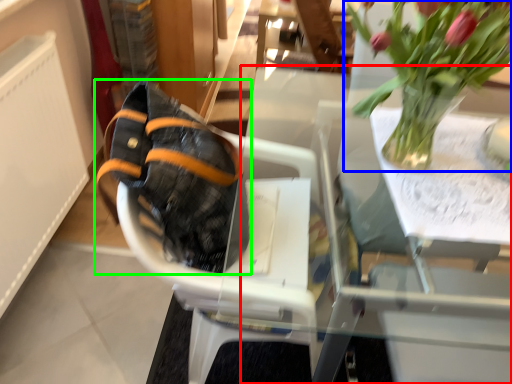
Question: Which object is positioned farthest from table (highlighted by a red box)? Select from houseplant (highlighted by a blue box) and footwear (highlighted by a green box).

Choices:
 (A) houseplant
 (B) footwear

Answer: (B)